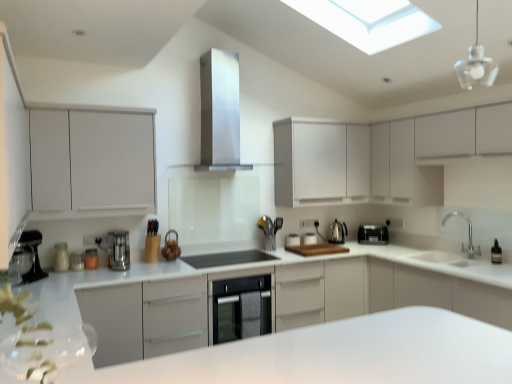
Question: Considering the relative positions of white glossy countertop at center and white glossy toaster at center, the eighth appliance from the left, in the image provided, is white glossy countertop at center to the left or to the right of white glossy toaster at center, the eighth appliance from the left,?

Choices:
 (A) right
 (B) left

Answer: (B)

Question: From the image's perspective, is white glossy countertop at center located above or below white glossy toaster at center, the 1th appliance viewed from the right?

Choices:
 (A) above
 (B) below

Answer: (B)

Question: Which object is positioned closest to the white matte cabinet at upper center, the second cabinetry positioned from the right?

Choices:
 (A) metallic silver utensil holder at center, placed as the sixth appliance when sorted from left to right
 (B) brown woven basket at center, the fifth appliance in the right-to-left sequence
 (C) satin silver coffee machine at left
 (D) black glass cooktop at center, acting as the fifth appliance starting from the left
 (E) metallic silver coffee maker at left, marked as the second appliance in a left-to-right arrangement

Answer: (A)

Question: Estimate the real-world distances between objects in this image. Which object is farther from the metallic silver coffee maker at left, which ranks as the 1th appliance in left-to-right order?

Choices:
 (A) white matte cabinet at upper left, which appears as the third cabinetry when viewed from the right
 (B) white glossy counter at center
 (C) satin silver kettle at center-right
 (D) transparent glass pendant light at upper right
 (E) white glossy toaster at center, positioned as the 7th appliance in left-to-right order

Answer: (D)